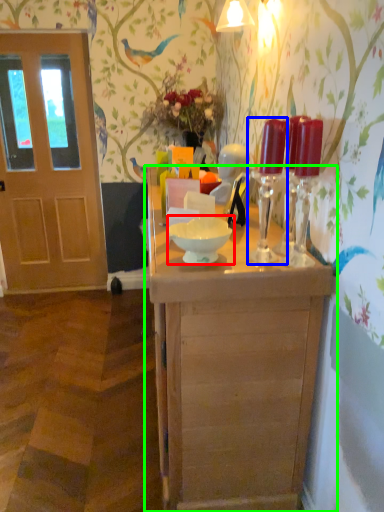
Question: Based on their relative distances, which object is farther from bowl (highlighted by a red box)? Choose from candle holder (highlighted by a blue box) and table (highlighted by a green box).

Choices:
 (A) candle holder
 (B) table

Answer: (B)